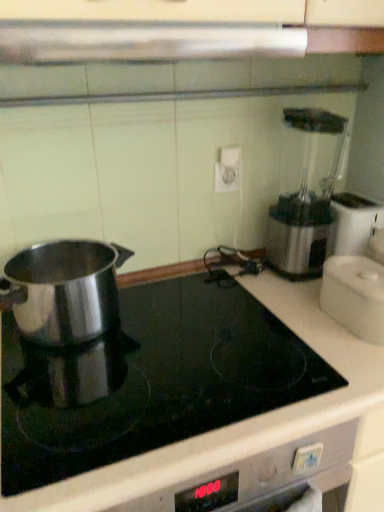
This screenshot has width=384, height=512. Identify the location of polished stainless steel pot at left, which appears as the 2th kitchen appliance when viewed from the left. (150, 380).

The height and width of the screenshot is (512, 384). Describe the element at coordinates (355, 295) in the screenshot. I see `white plastic container at right, which is counted as the first kitchen appliance, starting from the right` at that location.

Describe the element at coordinates (143, 42) in the screenshot. Image resolution: width=384 pixels, height=512 pixels. I see `satin silver exhaust hood at upper center` at that location.

Locate an element on the screen. polished stainless steel pot at left, arranged as the third kitchen appliance when viewed from the right is located at coordinates (64, 290).

Is polished stainless steel pot at left, which appears as the 2th kitchen appliance when viewed from the left, shorter than satin silver exhaust hood at upper center?

Incorrect, the height of polished stainless steel pot at left, which appears as the 2th kitchen appliance when viewed from the left, does not fall short of that of satin silver exhaust hood at upper center.

From a real-world perspective, which is physically below, polished stainless steel pot at left, arranged as the 2th kitchen appliance when viewed from the right, or satin silver exhaust hood at upper center?

From a 3D spatial view, polished stainless steel pot at left, arranged as the 2th kitchen appliance when viewed from the right, is below.

Between polished stainless steel pot at left, which appears as the 2th kitchen appliance when viewed from the left, and satin silver exhaust hood at upper center, which one has larger width?

With larger width is polished stainless steel pot at left, which appears as the 2th kitchen appliance when viewed from the left.

Measure the distance between white plastic container at right, the third kitchen appliance viewed from the left, and polished stainless steel pot at left, arranged as the 2th kitchen appliance when viewed from the right.

white plastic container at right, the third kitchen appliance viewed from the left, is 13.93 inches away from polished stainless steel pot at left, arranged as the 2th kitchen appliance when viewed from the right.

Does point (360, 276) come farther from viewer compared to point (150, 435)?

Yes, point (360, 276) is behind point (150, 435).

Which object is thinner, white plastic container at right, the third kitchen appliance viewed from the left, or polished stainless steel pot at left, which appears as the 2th kitchen appliance when viewed from the left?

With smaller width is white plastic container at right, the third kitchen appliance viewed from the left.

Who is more distant, white plastic container at right, the third kitchen appliance viewed from the left, or polished stainless steel pot at left, which appears as the 2th kitchen appliance when viewed from the left?

white plastic container at right, the third kitchen appliance viewed from the left, is further from the camera.

Do you think white plastic container at right, the third kitchen appliance viewed from the left, is within polished stainless steel pot at left, arranged as the 1th kitchen appliance when viewed from the left, or outside of it?

white plastic container at right, the third kitchen appliance viewed from the left, lies outside polished stainless steel pot at left, arranged as the 1th kitchen appliance when viewed from the left.

The width and height of the screenshot is (384, 512). What are the coordinates of `the 1st kitchen appliance positioned below the polished stainless steel pot at left, arranged as the third kitchen appliance when viewed from the right (from the image's perspective)` in the screenshot? It's located at (355, 295).

Is white plastic container at right, which is counted as the first kitchen appliance, starting from the right, positioned far away from polished stainless steel pot at left, arranged as the 1th kitchen appliance when viewed from the left?

white plastic container at right, which is counted as the first kitchen appliance, starting from the right, is actually quite close to polished stainless steel pot at left, arranged as the 1th kitchen appliance when viewed from the left.

Could you measure the distance between white plastic container at right, the third kitchen appliance viewed from the left, and polished stainless steel pot at left, arranged as the third kitchen appliance when viewed from the right?

white plastic container at right, the third kitchen appliance viewed from the left, and polished stainless steel pot at left, arranged as the third kitchen appliance when viewed from the right, are 22.87 inches apart from each other.

Is the surface of white plastic container at right, which is counted as the first kitchen appliance, starting from the right, in direct contact with satin silver exhaust hood at upper center?

No, white plastic container at right, which is counted as the first kitchen appliance, starting from the right, is not touching satin silver exhaust hood at upper center.

Considering the relative positions of white plastic container at right, the third kitchen appliance viewed from the left, and satin silver exhaust hood at upper center in the image provided, is white plastic container at right, the third kitchen appliance viewed from the left, to the left or to the right of satin silver exhaust hood at upper center?

Based on their positions, white plastic container at right, the third kitchen appliance viewed from the left, is located to the right of satin silver exhaust hood at upper center.

Based on the photo, how far apart are white plastic container at right, which is counted as the first kitchen appliance, starting from the right, and satin silver exhaust hood at upper center?

A distance of 54.09 centimeters exists between white plastic container at right, which is counted as the first kitchen appliance, starting from the right, and satin silver exhaust hood at upper center.

Is polished stainless steel pot at left, arranged as the third kitchen appliance when viewed from the right, closer to camera compared to satin silver exhaust hood at upper center?

No, the depth of polished stainless steel pot at left, arranged as the third kitchen appliance when viewed from the right, is greater than that of satin silver exhaust hood at upper center.

Which of these two, polished stainless steel pot at left, arranged as the 1th kitchen appliance when viewed from the left, or satin silver exhaust hood at upper center, is bigger?

polished stainless steel pot at left, arranged as the 1th kitchen appliance when viewed from the left, is bigger.

Can you confirm if polished stainless steel pot at left, arranged as the 1th kitchen appliance when viewed from the left, is positioned to the right of satin silver exhaust hood at upper center?

Incorrect, polished stainless steel pot at left, arranged as the 1th kitchen appliance when viewed from the left, is not on the right side of satin silver exhaust hood at upper center.

From the picture: Considering the sizes of objects polished stainless steel pot at left, which appears as the 2th kitchen appliance when viewed from the left, and polished stainless steel pot at left, arranged as the third kitchen appliance when viewed from the right, in the image provided, who is smaller, polished stainless steel pot at left, which appears as the 2th kitchen appliance when viewed from the left, or polished stainless steel pot at left, arranged as the third kitchen appliance when viewed from the right,?

With smaller size is polished stainless steel pot at left, arranged as the third kitchen appliance when viewed from the right.

Which point is more forward, [252,388] or [89,255]?

The point [252,388] is more forward.

Considering the relative sizes of polished stainless steel pot at left, arranged as the 2th kitchen appliance when viewed from the right, and polished stainless steel pot at left, arranged as the 1th kitchen appliance when viewed from the left, in the image provided, is polished stainless steel pot at left, arranged as the 2th kitchen appliance when viewed from the right, thinner than polished stainless steel pot at left, arranged as the 1th kitchen appliance when viewed from the left,?

In fact, polished stainless steel pot at left, arranged as the 2th kitchen appliance when viewed from the right, might be wider than polished stainless steel pot at left, arranged as the 1th kitchen appliance when viewed from the left.

From the image's perspective, relative to polished stainless steel pot at left, arranged as the third kitchen appliance when viewed from the right, is polished stainless steel pot at left, arranged as the 2th kitchen appliance when viewed from the right, above or below?

polished stainless steel pot at left, arranged as the 2th kitchen appliance when viewed from the right, is situated lower than polished stainless steel pot at left, arranged as the third kitchen appliance when viewed from the right, in the image.

Does satin silver exhaust hood at upper center turn towards polished stainless steel pot at left, arranged as the third kitchen appliance when viewed from the right?

No, satin silver exhaust hood at upper center is not turned towards polished stainless steel pot at left, arranged as the third kitchen appliance when viewed from the right.

Based on the photo, is satin silver exhaust hood at upper center next to polished stainless steel pot at left, arranged as the 1th kitchen appliance when viewed from the left?

satin silver exhaust hood at upper center is not next to polished stainless steel pot at left, arranged as the 1th kitchen appliance when viewed from the left, and they're not touching.

What's the angular difference between satin silver exhaust hood at upper center and polished stainless steel pot at left, arranged as the 1th kitchen appliance when viewed from the left,'s facing directions?

0.143 degrees separate the facing orientations of satin silver exhaust hood at upper center and polished stainless steel pot at left, arranged as the 1th kitchen appliance when viewed from the left.

From the image's perspective, is satin silver exhaust hood at upper center under polished stainless steel pot at left, arranged as the 1th kitchen appliance when viewed from the left?

No, from the image's perspective, satin silver exhaust hood at upper center is not below polished stainless steel pot at left, arranged as the 1th kitchen appliance when viewed from the left.

Where is `the 1st kitchen appliance to the right when counting from the satin silver exhaust hood at upper center`? The image size is (384, 512). the 1st kitchen appliance to the right when counting from the satin silver exhaust hood at upper center is located at coordinates (150, 380).

In order to click on the 2nd kitchen appliance behind the polished stainless steel pot at left, arranged as the 2th kitchen appliance when viewed from the right, starting your count from the anchor in this screenshot , I will do `click(355, 295)`.

When comparing their distances from polished stainless steel pot at left, arranged as the 1th kitchen appliance when viewed from the left, does polished stainless steel pot at left, which appears as the 2th kitchen appliance when viewed from the left, or satin silver exhaust hood at upper center seem further?

satin silver exhaust hood at upper center lies further to polished stainless steel pot at left, arranged as the 1th kitchen appliance when viewed from the left, than the other object.

Looking at the image, which one is located further to satin silver exhaust hood at upper center, white plastic container at right, the third kitchen appliance viewed from the left, or polished stainless steel pot at left, which appears as the 2th kitchen appliance when viewed from the left?

polished stainless steel pot at left, which appears as the 2th kitchen appliance when viewed from the left.

Considering their positions, is satin silver exhaust hood at upper center positioned further to polished stainless steel pot at left, which appears as the 2th kitchen appliance when viewed from the left, than polished stainless steel pot at left, arranged as the third kitchen appliance when viewed from the right?

satin silver exhaust hood at upper center lies further to polished stainless steel pot at left, which appears as the 2th kitchen appliance when viewed from the left, than the other object.

Which object lies nearer to the anchor point polished stainless steel pot at left, which appears as the 2th kitchen appliance when viewed from the left, white plastic container at right, the third kitchen appliance viewed from the left, or satin silver exhaust hood at upper center?

Based on the image, white plastic container at right, the third kitchen appliance viewed from the left, appears to be nearer to polished stainless steel pot at left, which appears as the 2th kitchen appliance when viewed from the left.

Considering their positions, is polished stainless steel pot at left, arranged as the 2th kitchen appliance when viewed from the right, positioned further to white plastic container at right, which is counted as the first kitchen appliance, starting from the right, than satin silver exhaust hood at upper center?

Based on the image, satin silver exhaust hood at upper center appears to be further to white plastic container at right, which is counted as the first kitchen appliance, starting from the right.

Which object lies nearer to the anchor point satin silver exhaust hood at upper center, polished stainless steel pot at left, arranged as the third kitchen appliance when viewed from the right, or polished stainless steel pot at left, arranged as the 2th kitchen appliance when viewed from the right?

polished stainless steel pot at left, arranged as the third kitchen appliance when viewed from the right, lies closer to satin silver exhaust hood at upper center than the other object.

Which object lies further to the anchor point polished stainless steel pot at left, arranged as the 1th kitchen appliance when viewed from the left, polished stainless steel pot at left, arranged as the 2th kitchen appliance when viewed from the right, or white plastic container at right, the third kitchen appliance viewed from the left?

white plastic container at right, the third kitchen appliance viewed from the left, lies further to polished stainless steel pot at left, arranged as the 1th kitchen appliance when viewed from the left, than the other object.

Looking at the image, which one is located further to polished stainless steel pot at left, which appears as the 2th kitchen appliance when viewed from the left, polished stainless steel pot at left, arranged as the third kitchen appliance when viewed from the right, or satin silver exhaust hood at upper center?

Based on the image, satin silver exhaust hood at upper center appears to be further to polished stainless steel pot at left, which appears as the 2th kitchen appliance when viewed from the left.

At what (x,y) coordinates should I click in order to perform the action: click on kitchen appliance located between polished stainless steel pot at left, arranged as the 1th kitchen appliance when viewed from the left, and white plastic container at right, the third kitchen appliance viewed from the left, in the left-right direction. Please return your answer as a coordinate pair (x, y). Image resolution: width=384 pixels, height=512 pixels. Looking at the image, I should click on (150, 380).

You are a GUI agent. You are given a task and a screenshot of the screen. Output one action in this format:
    pyautogui.click(x=<x>, y=<y>)
    Task: Click on the exhaust hood between polished stainless steel pot at left, arranged as the 1th kitchen appliance when viewed from the left, and white plastic container at right, the third kitchen appliance viewed from the left, in the horizontal direction
    Image resolution: width=384 pixels, height=512 pixels.
    Given the screenshot: What is the action you would take?
    pyautogui.click(x=143, y=42)